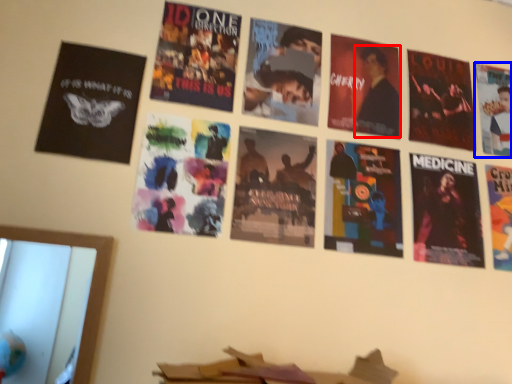
Question: Which of the following is the closest to the observer, person (highlighted by a red box) or poster (highlighted by a blue box)?

Choices:
 (A) person
 (B) poster

Answer: (A)